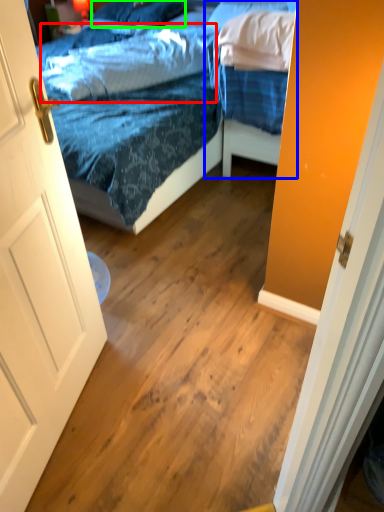
Question: Which object is the closest to the pillow (highlighted by a red box)? Choose among these: bed (highlighted by a blue box) or pillow (highlighted by a green box).

Choices:
 (A) bed
 (B) pillow

Answer: (A)